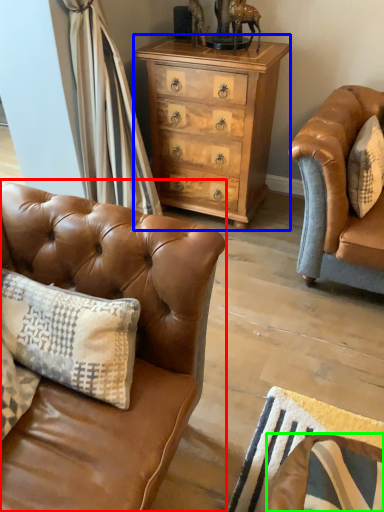
Question: Considering the real-world distances, which object is closest to studio couch (highlighted by a red box)? chest of drawers (highlighted by a blue box) or swivel chair (highlighted by a green box).

Choices:
 (A) chest of drawers
 (B) swivel chair

Answer: (B)